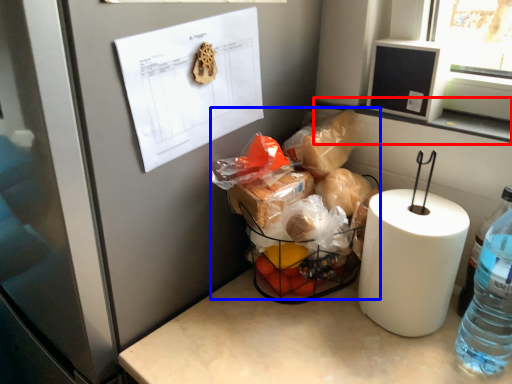
Question: Which object appears closest to the camera in this image, window sill (highlighted by a red box) or waste (highlighted by a blue box)?

Choices:
 (A) window sill
 (B) waste

Answer: (B)